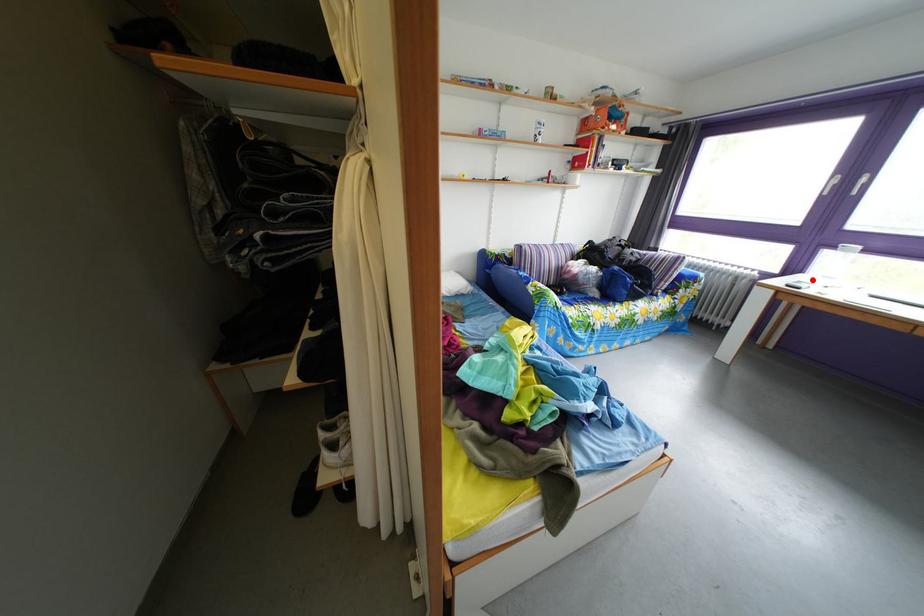
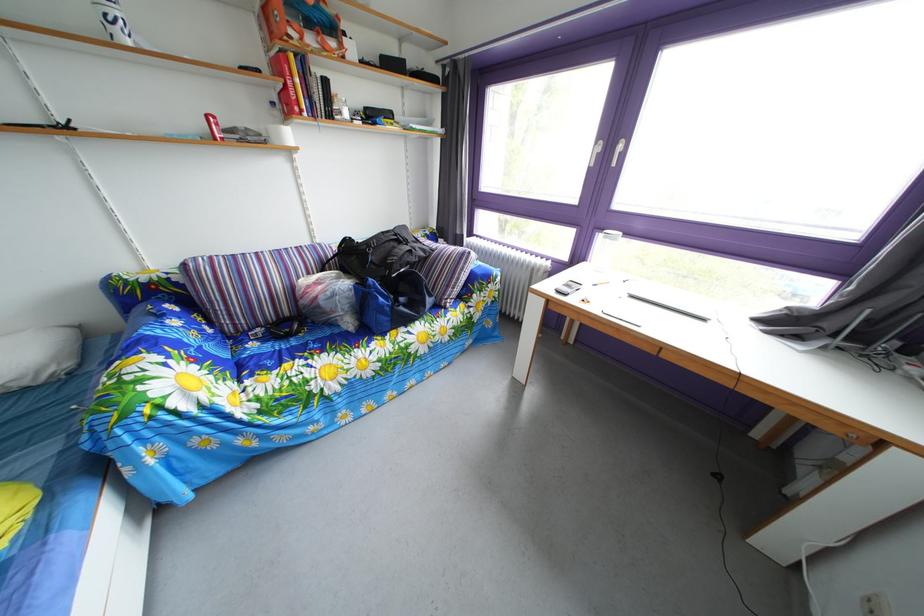
Question: I am providing you with two images of the same scene from different viewpoints. Given a red point in image1, look at the same physical point in image2. Is it:

Choices:
 (A) Closer to the viewpoint
 (B) Farther from the viewpoint

Answer: (A)